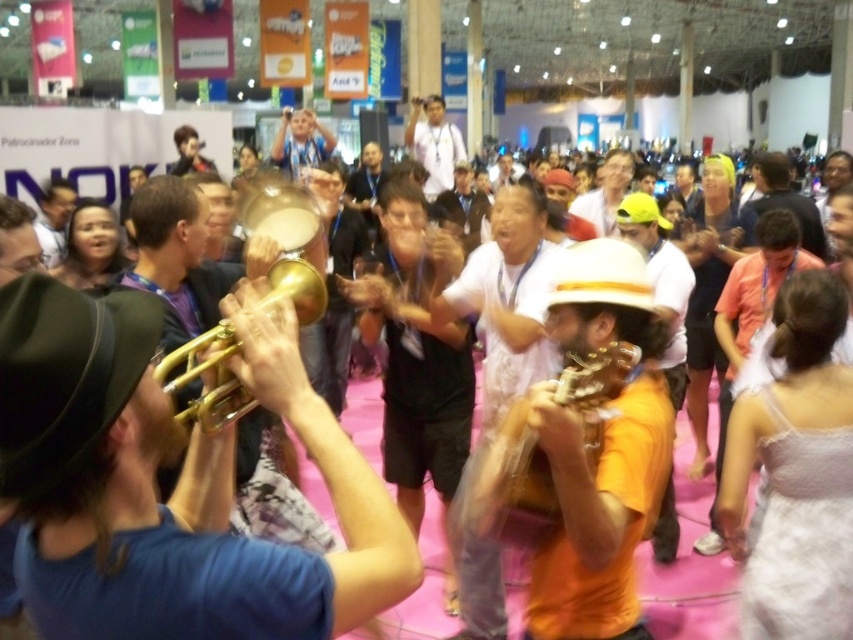
Can you confirm if orange matte guitar at center is taller than gold brass trumpet at center?

Indeed, orange matte guitar at center has a greater height compared to gold brass trumpet at center.

Who is more distant from viewer, (511, 406) or (190, 358)?

Positioned behind is point (511, 406).

Between point (637, 536) and point (198, 413), which one is positioned behind?

Positioned behind is point (637, 536).

You are a GUI agent. You are given a task and a screenshot of the screen. Output one action in this format:
    pyautogui.click(x=<x>, y=<y>)
    Task: Click on the orange matte guitar at center
    The width and height of the screenshot is (853, 640).
    Given the screenshot: What is the action you would take?
    pyautogui.click(x=589, y=452)

Between white fabric shirt at center and matte black hat at upper left, which one has more height?

Standing taller between the two is white fabric shirt at center.

Looking at this image, is white fabric shirt at center closer to the viewer compared to matte black hat at upper left?

No, it is not.

Between point (421, 141) and point (50, 246), which one is positioned in front?

Point (50, 246) is in front.

Locate an element on the screen. The width and height of the screenshot is (853, 640). white fabric shirt at center is located at coordinates point(433,144).

Who is lower down, white cotton shirt at center or light blue shirt at center?

white cotton shirt at center

Is white cotton shirt at center smaller than light blue shirt at center?

No, white cotton shirt at center is not smaller than light blue shirt at center.

This screenshot has height=640, width=853. Find the location of `white cotton shirt at center`. white cotton shirt at center is located at coordinates (503, 294).